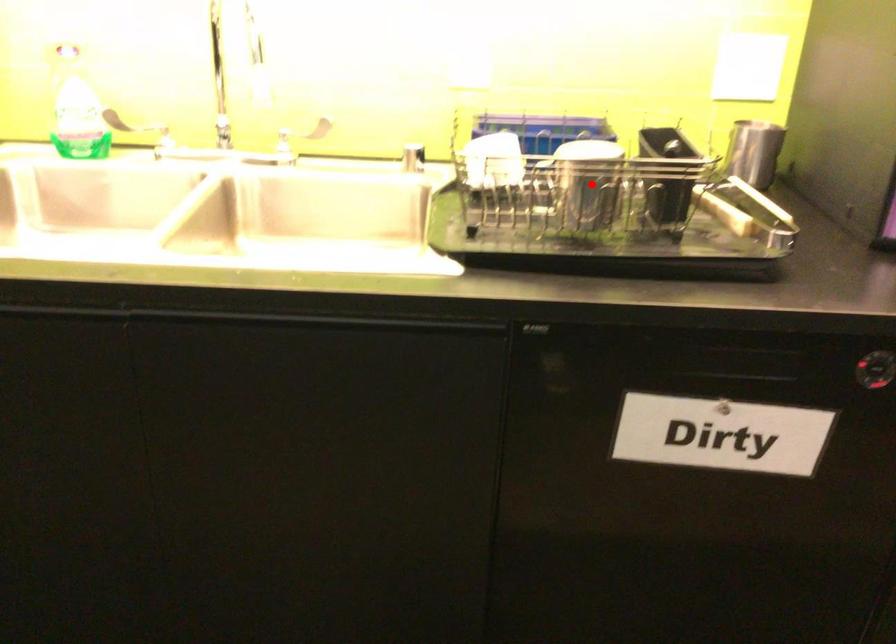
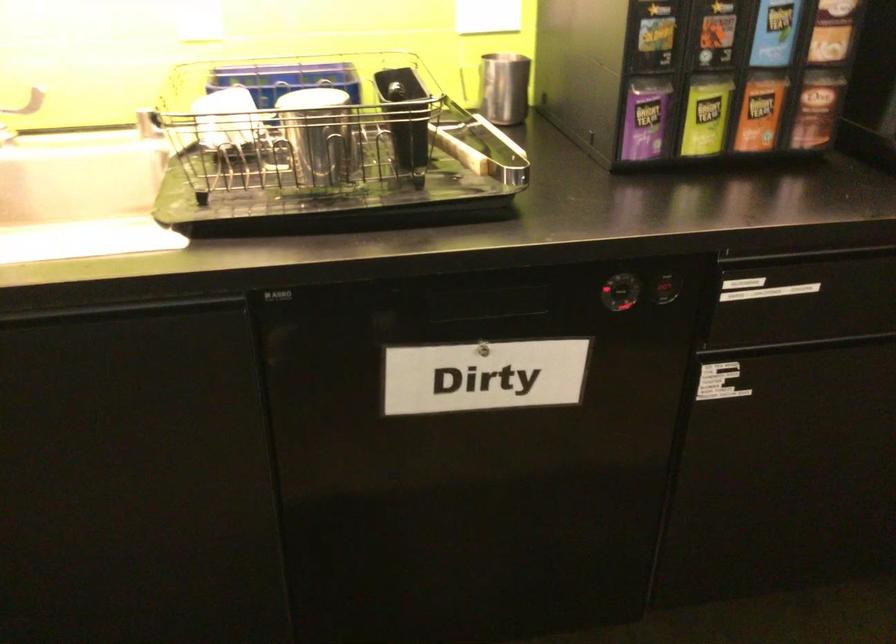
In the second image, find the point that corresponds to the highlighted location in the first image.

(319, 134)